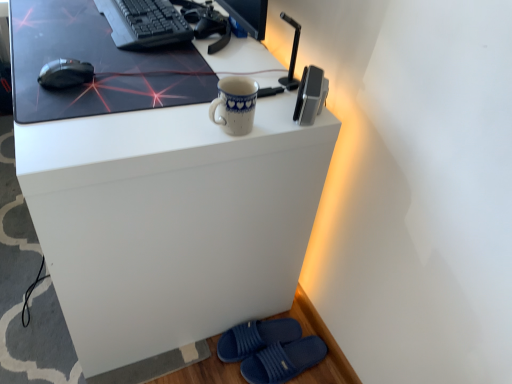
Where is `free space that is to the left of black matte mouse at left`? This screenshot has width=512, height=384. free space that is to the left of black matte mouse at left is located at coordinates (24, 60).